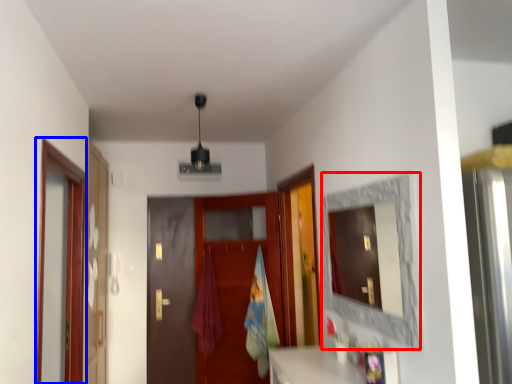
Question: Which object appears farthest to the camera in this image, mirror (highlighted by a red box) or screen door (highlighted by a blue box)?

Choices:
 (A) mirror
 (B) screen door

Answer: (B)